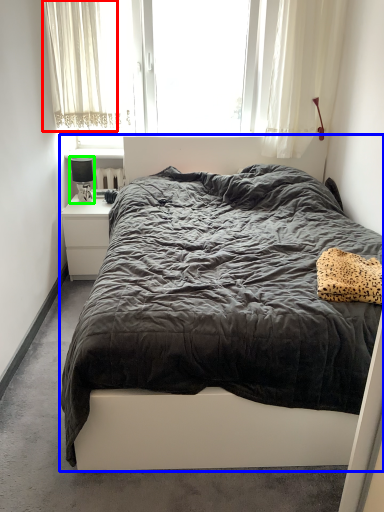
Question: Considering the real-world distances, which object is farthest from curtain (highlighted by a red box)? bed (highlighted by a blue box) or lamp (highlighted by a green box)?

Choices:
 (A) bed
 (B) lamp

Answer: (A)